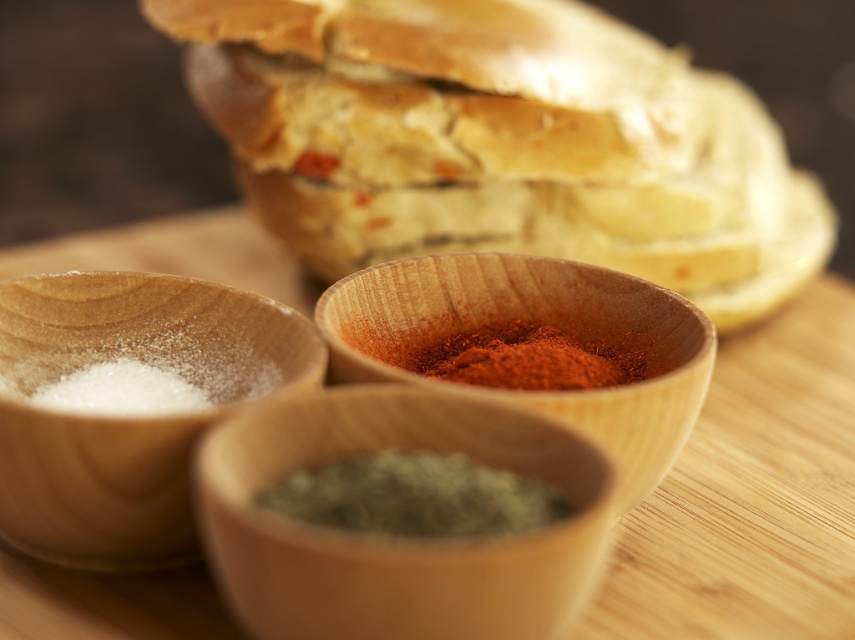
Question: Based on their relative distances, which object is farther from the red powder spice at center?

Choices:
 (A) slightly toasted bread at upper center
 (B) wooden spice at center

Answer: (A)

Question: Does green herb at center appear under red powder spice at center?

Choices:
 (A) yes
 (B) no

Answer: (A)

Question: Does slightly toasted bread at upper center have a smaller size compared to green speckled wood spice at center?

Choices:
 (A) yes
 (B) no

Answer: (B)

Question: Which point is farther to the camera?

Choices:
 (A) (453, 538)
 (B) (563, 218)
 (C) (90, 275)

Answer: (B)

Question: Does white powder at left appear under green herb at center?

Choices:
 (A) no
 (B) yes

Answer: (A)

Question: Estimate the real-world distances between objects in this image. Which object is farther from the white powder at left?

Choices:
 (A) green herb at center
 (B) slightly toasted bread at upper center
 (C) wooden spice at center

Answer: (B)